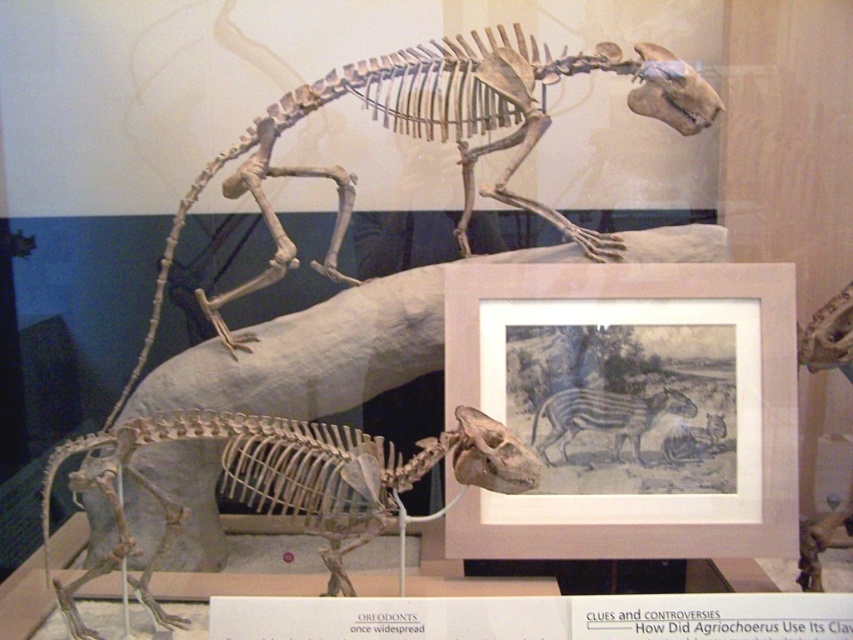
Question: Which point appears closest to the camera in this image?

Choices:
 (A) (534, 522)
 (B) (642, 426)
 (C) (674, 452)

Answer: (A)

Question: Among these objects, which one is nearest to the camera?

Choices:
 (A) matte paper picture frame at center
 (B) grayish-brown textured zebra at center

Answer: (A)

Question: Can you confirm if matte paper picture frame at center is smaller than grayish-brown textured zebra at center?

Choices:
 (A) yes
 (B) no

Answer: (B)

Question: Among these points, which one is nearest to the camera?

Choices:
 (A) (575, 392)
 (B) (724, 433)
 (C) (723, 516)

Answer: (C)

Question: Is grayish-brown textured zebra at center below gray textured zebra at center?

Choices:
 (A) yes
 (B) no

Answer: (B)

Question: Does matte paper picture frame at center lie behind grayish-brown textured zebra at center?

Choices:
 (A) no
 (B) yes

Answer: (A)